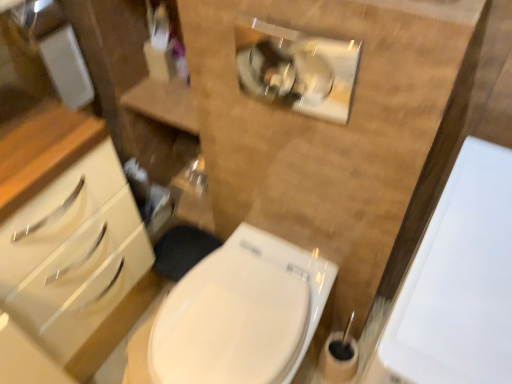
Where is `white glossy porcelain at right`? The height and width of the screenshot is (384, 512). white glossy porcelain at right is located at coordinates (460, 280).

What do you see at coordinates (460, 280) in the screenshot? I see `white glossy porcelain at right` at bounding box center [460, 280].

This screenshot has height=384, width=512. Describe the element at coordinates (238, 313) in the screenshot. I see `white glossy toilet at center` at that location.

Image resolution: width=512 pixels, height=384 pixels. In order to click on white glossy toilet at center in this screenshot , I will do [x=238, y=313].

You are a GUI agent. You are given a task and a screenshot of the screen. Output one action in this format:
    pyautogui.click(x=<x>, y=<y>)
    Task: Click on the white glossy porcelain at right
    Image resolution: width=512 pixels, height=384 pixels.
    Given the screenshot: What is the action you would take?
    pyautogui.click(x=460, y=280)

In the image, is white glossy toilet at center on the left side or the right side of white glossy porcelain at right?

From the image, it's evident that white glossy toilet at center is to the left of white glossy porcelain at right.

In the image, is white glossy toilet at center positioned in front of or behind white glossy porcelain at right?

Visually, white glossy toilet at center is located behind white glossy porcelain at right.

Considering the positions of points (132, 378) and (384, 365), is point (132, 378) farther from camera compared to point (384, 365)?

Yes, point (132, 378) is farther from viewer.

From the image's perspective, is white glossy toilet at center on top of white glossy porcelain at right?

No.

From a real-world perspective, is white glossy toilet at center on top of white glossy porcelain at right?

No, from a real-world perspective, white glossy toilet at center is not over white glossy porcelain at right

Considering the sizes of objects white glossy toilet at center and white glossy porcelain at right in the image provided, who is wider, white glossy toilet at center or white glossy porcelain at right?

With larger width is white glossy porcelain at right.

Can you confirm if white glossy toilet at center is taller than white glossy porcelain at right?

No.

Considering the sizes of objects white glossy toilet at center and white glossy porcelain at right in the image provided, who is bigger, white glossy toilet at center or white glossy porcelain at right?

white glossy porcelain at right is bigger.

Is white glossy toilet at center not inside white glossy porcelain at right?

Indeed, white glossy toilet at center is completely outside white glossy porcelain at right.

Is white glossy toilet at center next to white glossy porcelain at right and touching it?

Answer: No, white glossy toilet at center is not in contact with white glossy porcelain at right.

Is white glossy toilet at center turned away from white glossy porcelain at right?

That's not correct — white glossy toilet at center is not looking away from white glossy porcelain at right.

You are a GUI agent. You are given a task and a screenshot of the screen. Output one action in this format:
    pyautogui.click(x=<x>, y=<y>)
    Task: Click on the toilet behind the white glossy porcelain at right
    This screenshot has height=384, width=512.
    Given the screenshot: What is the action you would take?
    tap(238, 313)

Considering the relative positions of white glossy porcelain at right and white glossy toilet at center in the image provided, is white glossy porcelain at right to the right of white glossy toilet at center from the viewer's perspective?

Indeed, white glossy porcelain at right is positioned on the right side of white glossy toilet at center.

Is white glossy porcelain at right behind white glossy toilet at center?

No.

Which is farther, (494, 305) or (206, 274)?

The point (206, 274) is behind.

From the image's perspective, is white glossy porcelain at right located beneath white glossy toilet at center?

No.

From a real-world perspective, relative to white glossy toilet at center, is white glossy porcelain at right vertically above or below?

Clearly, from a real-world perspective, white glossy porcelain at right is above white glossy toilet at center.

In the scene shown: In terms of width, does white glossy porcelain at right look wider or thinner when compared to white glossy toilet at center?

Considering their sizes, white glossy porcelain at right looks broader than white glossy toilet at center.

From their relative heights in the image, would you say white glossy porcelain at right is taller or shorter than white glossy toilet at center?

Considering their sizes, white glossy porcelain at right has more height than white glossy toilet at center.

In terms of size, does white glossy porcelain at right appear bigger or smaller than white glossy toilet at center?

Considering their sizes, white glossy porcelain at right takes up more space than white glossy toilet at center.

Is white glossy porcelain at right outside of white glossy toilet at center?

Absolutely, white glossy porcelain at right is external to white glossy toilet at center.

Does white glossy porcelain at right touch white glossy toilet at center?

No, white glossy porcelain at right is not touching white glossy toilet at center.

Could you tell me if white glossy porcelain at right is turned towards white glossy toilet at center?

No, white glossy porcelain at right is not aimed at white glossy toilet at center.

Consider the image. How different are the orientations of white glossy porcelain at right and white glossy toilet at center in degrees?

The facing directions of white glossy porcelain at right and white glossy toilet at center are 1.3 degrees apart.

Locate an element on the screen. toilet behind the white glossy porcelain at right is located at coordinates (238, 313).

This screenshot has height=384, width=512. Identify the location of porcelain that is on the right side of white glossy toilet at center. (460, 280).

Where is `toilet on the left of the white glossy porcelain at right`? The image size is (512, 384). toilet on the left of the white glossy porcelain at right is located at coordinates (238, 313).